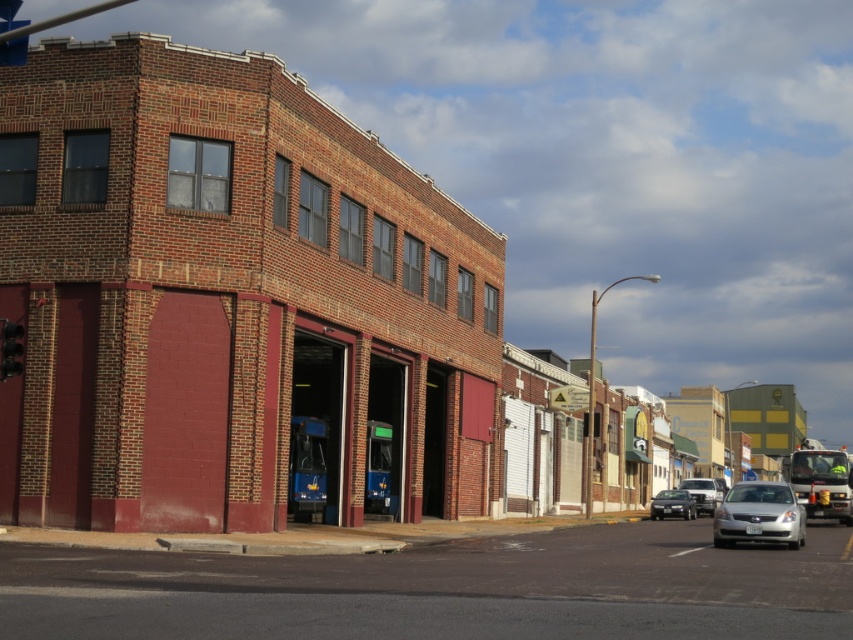
You are a delivery driver who needs to park your 2.5 meter long truck in this street scene. The metallic at left and the satin silver sedan at center are already parked. Can you fit your truck between them without moving any existing vehicles?

The metallic at left is shorter than the satin silver sedan at center, but the exact distance between them isn not provided. Without knowing the space between the two vehicles, it is impossible to determine if your truck will fit.